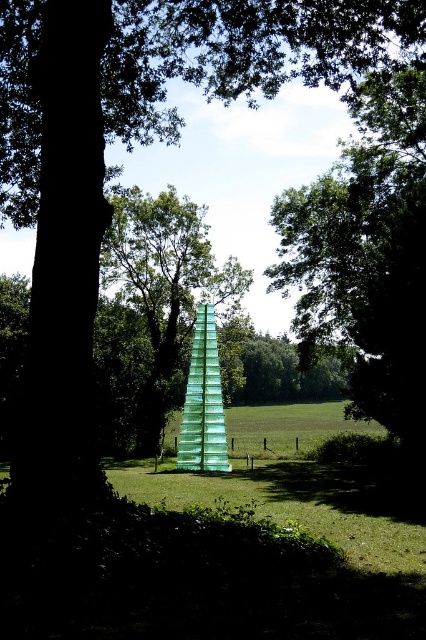
Question: Can you confirm if green leafy tree at center is positioned above transparent glass tower at center?

Choices:
 (A) yes
 (B) no

Answer: (A)

Question: Can you confirm if transparent glass tower at center is wider than green glass tower at center?

Choices:
 (A) no
 (B) yes

Answer: (B)

Question: Does green leafy tree at center have a smaller size compared to transparent glass tower at center?

Choices:
 (A) no
 (B) yes

Answer: (A)

Question: Among these points, which one is nearest to the camera?

Choices:
 (A) (351, 268)
 (B) (222, 392)
 (C) (224, 461)

Answer: (C)

Question: Which point appears farthest from the camera in this image?

Choices:
 (A) (204, 340)
 (B) (149, 365)
 (C) (362, 294)

Answer: (B)

Question: Which point is farther from the camera taking this photo?

Choices:
 (A) (216, 355)
 (B) (351, 168)

Answer: (B)